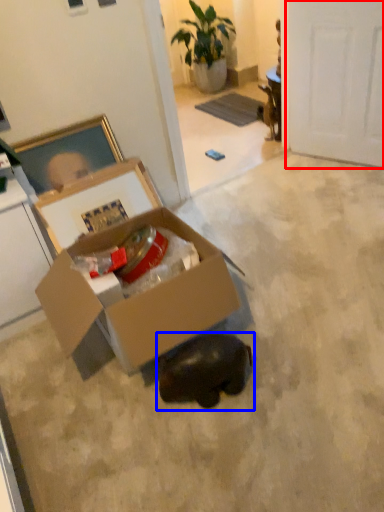
Question: Among these objects, which one is farthest to the camera, door (highlighted by a red box) or animal (highlighted by a blue box)?

Choices:
 (A) door
 (B) animal

Answer: (A)